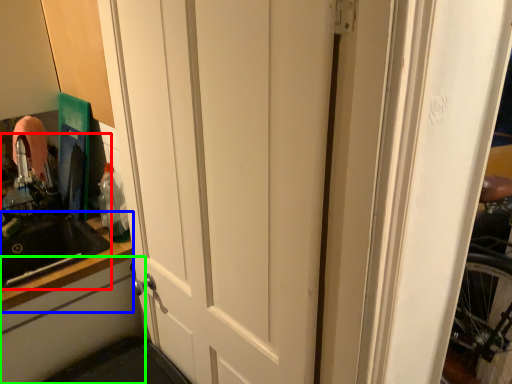
Question: Estimate the real-world distances between objects in this image. Which object is farther from sink (highlighted by a red box), counter top (highlighted by a blue box) or cabinetry (highlighted by a green box)?

Choices:
 (A) counter top
 (B) cabinetry

Answer: (B)